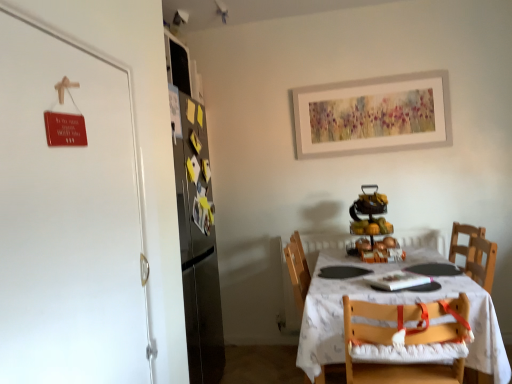
What is the approximate height of metallic refrigerator at upper left?

metallic refrigerator at upper left is 13.58 inches tall.

Locate an element on the screen. wooden chair with white cushion at lower right is located at coordinates (406, 339).

What is the approximate height of white matte door at left?

35.41 inches.

The width and height of the screenshot is (512, 384). What are the coordinates of `shiny metallic fruit stand at center` in the screenshot? It's located at click(x=371, y=227).

This screenshot has height=384, width=512. Describe the element at coordinates (371, 227) in the screenshot. I see `shiny metallic fruit stand at center` at that location.

Find the location of a particular element. white cloth-covered table at center is located at coordinates (394, 304).

Is shiny metallic fruit stand at center directly adjacent to white matte door at left?

No, shiny metallic fruit stand at center is not beside white matte door at left.

From the image's perspective, which object appears higher, shiny metallic fruit stand at center or white matte door at left?

white matte door at left appears higher in the image.

Does shiny metallic fruit stand at center have a greater height compared to white matte door at left?

Incorrect, the height of shiny metallic fruit stand at center is not larger of that of white matte door at left.

The image size is (512, 384). Find the location of `fruit below the metallic refrigerator at upper left (from the image's perspective)`. fruit below the metallic refrigerator at upper left (from the image's perspective) is located at coordinates (371, 227).

From the image's perspective, which is above, shiny metallic fruit stand at center or metallic refrigerator at upper left?

metallic refrigerator at upper left is shown above in the image.

Are shiny metallic fruit stand at center and metallic refrigerator at upper left making contact?

No, shiny metallic fruit stand at center is not in contact with metallic refrigerator at upper left.

Between shiny metallic fruit stand at center and metallic refrigerator at upper left, which one has larger width?

shiny metallic fruit stand at center is wider.

From the image's perspective, is metallic refrigerator at upper left located beneath wooden chair with white cushion at lower right?

No, from the image's perspective, metallic refrigerator at upper left is not below wooden chair with white cushion at lower right.

Does metallic refrigerator at upper left have a greater height compared to wooden chair with white cushion at lower right?

Incorrect, the height of metallic refrigerator at upper left is not larger of that of wooden chair with white cushion at lower right.

How many degrees apart are the facing directions of metallic refrigerator at upper left and wooden chair with white cushion at lower right?

There is a 90.5-degree angle between the facing directions of metallic refrigerator at upper left and wooden chair with white cushion at lower right.

Can you confirm if metallic refrigerator at upper left is bigger than wooden chair with white cushion at lower right?

No, metallic refrigerator at upper left is not bigger than wooden chair with white cushion at lower right.

Considering the positions of objects metallic refrigerator at upper left and white cloth-covered table at center in the image provided, who is more to the right, metallic refrigerator at upper left or white cloth-covered table at center?

white cloth-covered table at center is more to the right.

How different are the orientations of metallic refrigerator at upper left and white cloth-covered table at center in degrees?

They differ by 89.5 degrees in their facing directions.

Considering the relative sizes of metallic refrigerator at upper left and white cloth-covered table at center in the image provided, is metallic refrigerator at upper left bigger than white cloth-covered table at center?

No.

From the image's perspective, is metallic refrigerator at upper left above or below white cloth-covered table at center?

metallic refrigerator at upper left is above white cloth-covered table at center.

Is shiny metallic fruit stand at center bigger than white cloth-covered table at center?

No, shiny metallic fruit stand at center is not bigger than white cloth-covered table at center.

Looking at this image, are shiny metallic fruit stand at center and white cloth-covered table at center making contact?

No, shiny metallic fruit stand at center is not next to white cloth-covered table at center.

From a real-world perspective, relative to white cloth-covered table at center, is shiny metallic fruit stand at center vertically above or below?

In terms of real-world spatial position, shiny metallic fruit stand at center is above white cloth-covered table at center.

Is the position of shiny metallic fruit stand at center less distant than that of white cloth-covered table at center?

No, the depth of shiny metallic fruit stand at center is greater than that of white cloth-covered table at center.

Is wooden chair with white cushion at lower right facing away from white matte door at left?

wooden chair with white cushion at lower right does not have its back to white matte door at left.

Does point (449, 373) come closer to viewer compared to point (37, 231)?

No, (449, 373) is further to viewer.

Consider the image. Does wooden chair with white cushion at lower right come behind white matte door at left?

Yes, wooden chair with white cushion at lower right is behind white matte door at left.

From the image's perspective, is wooden chair with white cushion at lower right above or below white matte door at left?

wooden chair with white cushion at lower right is situated lower than white matte door at left in the image.

Looking at this image, from a real-world perspective, is white matte door at left above or below white cloth-covered table at center?

white matte door at left is above white cloth-covered table at center.

Which point is more forward, (120, 71) or (308, 353)?

The point (120, 71) is in front.

Looking at this image, is white matte door at left in front of or behind white cloth-covered table at center in the image?

white matte door at left is positioned closer to the viewer than white cloth-covered table at center.

Is white matte door at left wider or thinner than white cloth-covered table at center?

Clearly, white matte door at left has less width compared to white cloth-covered table at center.

The height and width of the screenshot is (384, 512). In order to click on fruit below the white matte door at left (from the image's perspective) in this screenshot , I will do `click(371, 227)`.

What are the coordinates of `fruit located in front of the metallic refrigerator at upper left` in the screenshot? It's located at (371, 227).

Looking at the image, which one is located closer to metallic refrigerator at upper left, white cloth-covered table at center or wooden chair with white cushion at lower right?

The object closer to metallic refrigerator at upper left is white cloth-covered table at center.

Which object lies further to the anchor point white cloth-covered table at center, metallic refrigerator at upper left or white matte door at left?

metallic refrigerator at upper left lies further to white cloth-covered table at center than the other object.

Looking at this image, from the image, which object appears to be farther from metallic refrigerator at upper left, shiny metallic fruit stand at center or white cloth-covered table at center?

The object further to metallic refrigerator at upper left is white cloth-covered table at center.

When comparing their distances from shiny metallic fruit stand at center, does white cloth-covered table at center or white matte door at left seem closer?

Based on the image, white cloth-covered table at center appears to be nearer to shiny metallic fruit stand at center.

When comparing their distances from wooden chair with white cushion at lower right, does metallic refrigerator at upper left or shiny metallic fruit stand at center seem further?

The object further to wooden chair with white cushion at lower right is metallic refrigerator at upper left.

When comparing their distances from shiny metallic fruit stand at center, does white matte door at left or wooden chair with white cushion at lower right seem closer?

Among the two, wooden chair with white cushion at lower right is located nearer to shiny metallic fruit stand at center.

From the picture: When comparing their distances from white matte door at left, does white cloth-covered table at center or shiny metallic fruit stand at center seem closer?

Among the two, white cloth-covered table at center is located nearer to white matte door at left.

When comparing their distances from shiny metallic fruit stand at center, does white cloth-covered table at center or metallic refrigerator at upper left seem closer?

Based on the image, white cloth-covered table at center appears to be nearer to shiny metallic fruit stand at center.

Identify the location of fruit located between white matte door at left and metallic refrigerator at upper left in the depth direction. Image resolution: width=512 pixels, height=384 pixels. (371, 227).

At what (x,y) coordinates should I click in order to perform the action: click on table between white matte door at left and metallic refrigerator at upper left from front to back. Please return your answer as a coordinate pair (x, y). The image size is (512, 384). Looking at the image, I should click on (394, 304).

Where is `chair that lies between metallic refrigerator at upper left and white cloth-covered table at center from top to bottom`? This screenshot has width=512, height=384. chair that lies between metallic refrigerator at upper left and white cloth-covered table at center from top to bottom is located at coordinates (406, 339).

In order to click on table between wooden chair with white cushion at lower right and shiny metallic fruit stand at center from front to back in this screenshot , I will do `click(394, 304)`.